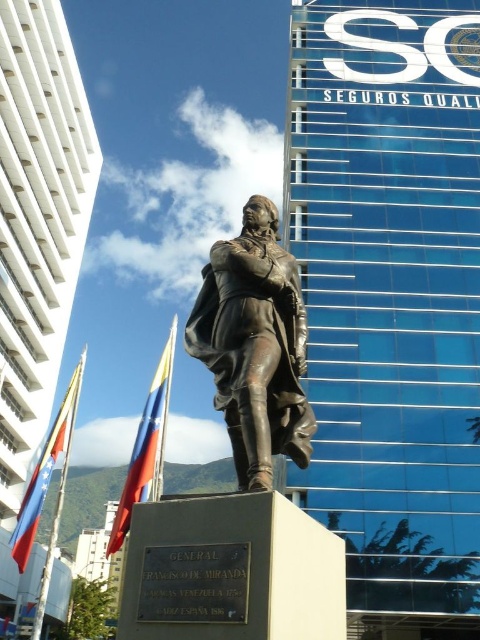
How far apart are red fabric flag at center and red fabric flag at lower left?

The distance of red fabric flag at center from red fabric flag at lower left is 17.26 meters.

Is red fabric flag at center smaller than red fabric flag at lower left?

No, red fabric flag at center is not smaller than red fabric flag at lower left.

Locate an element on the screen. red fabric flag at center is located at coordinates (145, 449).

This screenshot has height=640, width=480. What are the coordinates of `red fabric flag at center` in the screenshot? It's located at (145, 449).

Between bronze statue at center and red fabric flag at lower left, which one has more height?

red fabric flag at lower left is taller.

Is bronze statue at center to the right of red fabric flag at lower left from the viewer's perspective?

Correct, you'll find bronze statue at center to the right of red fabric flag at lower left.

Image resolution: width=480 pixels, height=640 pixels. Describe the element at coordinates (254, 346) in the screenshot. I see `bronze statue at center` at that location.

You are a GUI agent. You are given a task and a screenshot of the screen. Output one action in this format:
    pyautogui.click(x=<x>, y=<y>)
    Task: Click on the bronze statue at center
    This screenshot has width=480, height=640.
    Given the screenshot: What is the action you would take?
    tap(254, 346)

Is point (273, 259) farther from camera compared to point (117, 545)?

No, it is not.

Who is more distant from viewer, [218,308] or [172,340]?

Positioned behind is point [172,340].

I want to click on bronze statue at center, so click(x=254, y=346).